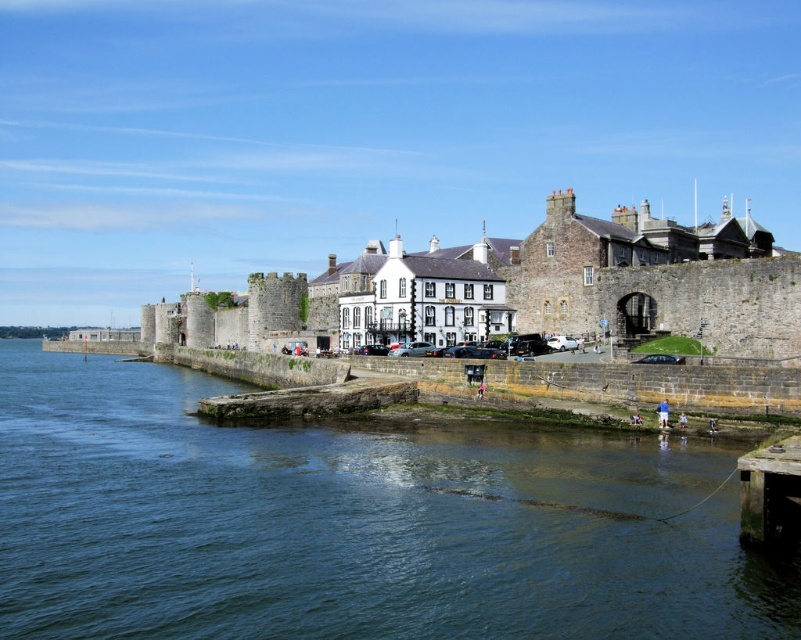
You are standing at the edge of the waterfront scene and want to walk from the green stone river at center to the smooth concrete dock at lower right. Which direction should you move to reach the dock?

To reach the smooth concrete dock at lower right from the green stone river at center, you should move downward since the green stone river at center is closer to the viewer than the smooth concrete dock at lower right.